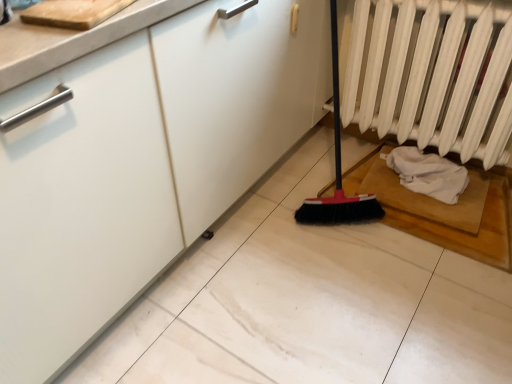
What is the approximate width of white fabric at lower right?

The width of white fabric at lower right is 8.92 inches.

Describe the element at coordinates (428, 173) in the screenshot. The height and width of the screenshot is (384, 512). I see `white fabric at lower right` at that location.

What is the approximate height of white fabric at lower right?

The height of white fabric at lower right is 3.64 inches.

Locate an element on the screen. white fabric at lower right is located at coordinates (428, 173).

The width and height of the screenshot is (512, 384). What do you see at coordinates (432, 75) in the screenshot?
I see `white matte radiator at right` at bounding box center [432, 75].

You are a GUI agent. You are given a task and a screenshot of the screen. Output one action in this format:
    pyautogui.click(x=<x>, y=<y>)
    Task: Click on the white matte radiator at right
    The image size is (512, 384).
    Given the screenshot: What is the action you would take?
    pyautogui.click(x=432, y=75)

Locate an element on the screen. white fabric at lower right is located at coordinates (428, 173).

Is white fabric at lower right to the left or to the right of white matte radiator at right in the image?

white fabric at lower right is to the right of white matte radiator at right.

Is the position of white fabric at lower right less distant than that of white matte radiator at right?

No, white fabric at lower right is further to the viewer.

Does point (424, 191) lie in front of point (476, 83)?

No, (424, 191) is behind (476, 83).

In the scene shown: From the image's perspective, which one is positioned higher, white fabric at lower right or white matte radiator at right?

white matte radiator at right.

From a real-world perspective, between white fabric at lower right and white matte radiator at right, who is vertically higher?

white matte radiator at right.

Is white fabric at lower right wider or thinner than white matte radiator at right?

In the image, white fabric at lower right appears to be wider than white matte radiator at right.

Can you confirm if white fabric at lower right is shorter than white matte radiator at right?

Yes, white fabric at lower right is shorter than white matte radiator at right.

Who is bigger, white fabric at lower right or white matte radiator at right?

white matte radiator at right is bigger.

Is white fabric at lower right positioned beyond the bounds of white matte radiator at right?

white fabric at lower right is positioned outside white matte radiator at right.

Is white fabric at lower right with white matte radiator at right?

No, white fabric at lower right is not beside white matte radiator at right.

In the scene shown: Is white fabric at lower right looking in the opposite direction of white matte radiator at right?

white fabric at lower right is not turned away from white matte radiator at right.

What's the angular difference between white fabric at lower right and white matte radiator at right's facing directions?

There is a 0.677-degree angle between the facing directions of white fabric at lower right and white matte radiator at right.

Locate an element on the screen. This screenshot has height=384, width=512. radiator in front of the white fabric at lower right is located at coordinates (432, 75).

Does white matte radiator at right appear on the right side of white fabric at lower right?

No, white matte radiator at right is not to the right of white fabric at lower right.

Which object is more forward, white matte radiator at right or white fabric at lower right?

Positioned in front is white matte radiator at right.

Is point (401, 132) closer to camera compared to point (401, 170)?

No.

From the image's perspective, which object appears higher, white matte radiator at right or white fabric at lower right?

white matte radiator at right appears higher in the image.

From a real-world perspective, which is physically above, white matte radiator at right or white fabric at lower right?

white matte radiator at right.

Does white matte radiator at right have a greater width compared to white fabric at lower right?

In fact, white matte radiator at right might be narrower than white fabric at lower right.

Is white matte radiator at right taller than white fabric at lower right?

Yes.

Can you confirm if white matte radiator at right is smaller than white fabric at lower right?

No, white matte radiator at right is not smaller than white fabric at lower right.

Can we say white matte radiator at right lies outside white fabric at lower right?

Yes, white matte radiator at right is located beyond the bounds of white fabric at lower right.

Is white matte radiator at right far from white fabric at lower right?

Actually, white matte radiator at right and white fabric at lower right are a little close together.

Is white matte radiator at right aimed at white fabric at lower right?

No, white matte radiator at right is not oriented towards white fabric at lower right.

Image resolution: width=512 pixels, height=384 pixels. Identify the location of radiator lying above the white fabric at lower right (from the image's perspective). (432, 75).

What are the coordinates of `radiator that appears in front of the white fabric at lower right` in the screenshot? It's located at (432, 75).

The image size is (512, 384). Find the location of `material below the white matte radiator at right (from the image's perspective)`. material below the white matte radiator at right (from the image's perspective) is located at coordinates (428, 173).